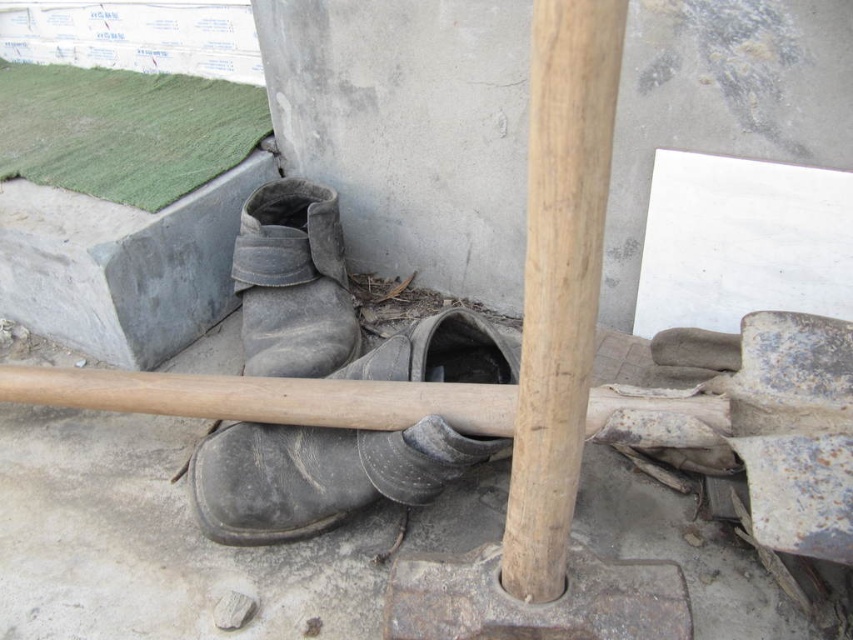
You are standing at the center of the construction site and see two points marked on the ground. The first point is at coordinates point (500, 387) and the second point is at point (585, 364). Which point is closer to you?

Point (500, 387) is behind point (585, 364), so the closer point to you is point (585, 364).

You are a construction worker who needs to store the rusty metal shovel at center and the smooth wood pole at center in a storage bin that is 1 meter wide. Can both items fit side by side horizontally without overlapping?

The rusty metal shovel at center might be wider than the smooth wood pole at center, so there is a possibility that the combined width of both items could exceed the 1 meter width of the storage bin. It is uncertain if they can fit without overlapping without more specific measurements.